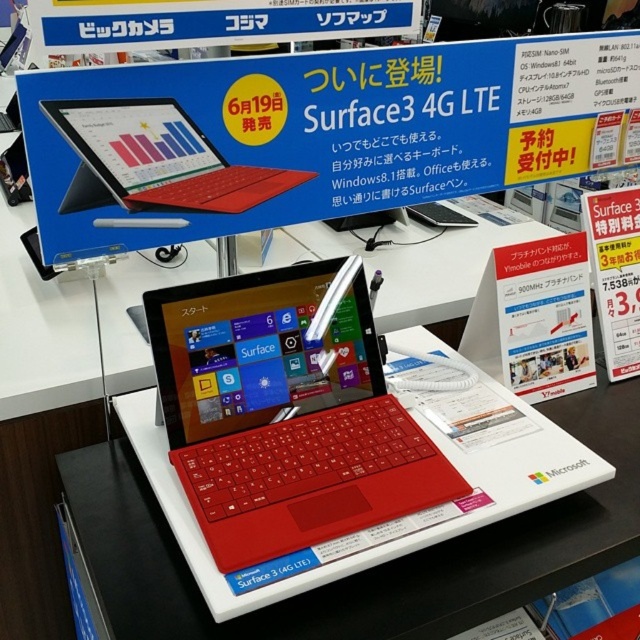
Question: Which is farther from the blue glossy poster at upper center?

Choices:
 (A) white plastic table at center
 (B) matte red laptop at center
 (C) matte red laptop at upper center

Answer: (A)

Question: Does blue glossy poster at upper center lie in front of white plastic table at center?

Choices:
 (A) no
 (B) yes

Answer: (A)

Question: Does blue glossy poster at upper center have a larger size compared to matte red laptop at center?

Choices:
 (A) yes
 (B) no

Answer: (A)

Question: Does blue glossy poster at upper center lie in front of white plastic table at center?

Choices:
 (A) yes
 (B) no

Answer: (B)

Question: Which object is farther from the camera taking this photo?

Choices:
 (A) matte red laptop at upper center
 (B) blue glossy poster at upper center
 (C) white plastic table at center
 (D) matte red laptop at center

Answer: (A)

Question: Which point is closer to the camera?

Choices:
 (A) white plastic table at center
 (B) matte red laptop at center
 (C) blue glossy poster at upper center

Answer: (A)